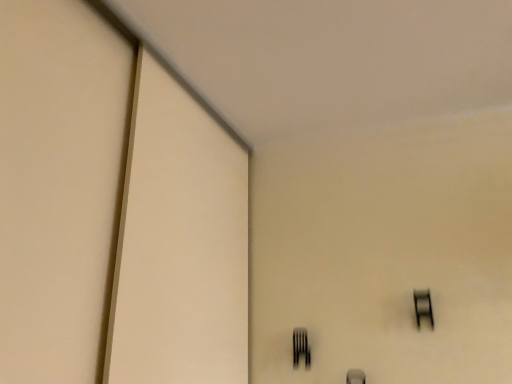
Question: From a real-world perspective, relative to black matte fork at lower center, is black glass window at upper right vertically above or below?

Choices:
 (A) below
 (B) above

Answer: (B)

Question: Is black glass window at upper right to the left or to the right of black matte fork at lower center in the image?

Choices:
 (A) left
 (B) right

Answer: (B)

Question: Considering the positions of black glass window at upper right and black matte fork at lower center in the image, is black glass window at upper right bigger or smaller than black matte fork at lower center?

Choices:
 (A) small
 (B) big

Answer: (B)

Question: From their relative heights in the image, would you say black matte fork at lower center is taller or shorter than black glass window at upper right?

Choices:
 (A) short
 (B) tall

Answer: (A)

Question: Is black matte fork at lower center situated inside black glass window at upper right or outside?

Choices:
 (A) inside
 (B) outside

Answer: (B)

Question: Based on their sizes in the image, would you say black matte fork at lower center is bigger or smaller than black glass window at upper right?

Choices:
 (A) small
 (B) big

Answer: (A)

Question: From the image's perspective, is black matte fork at lower center located above or below black glass window at upper right?

Choices:
 (A) below
 (B) above

Answer: (A)